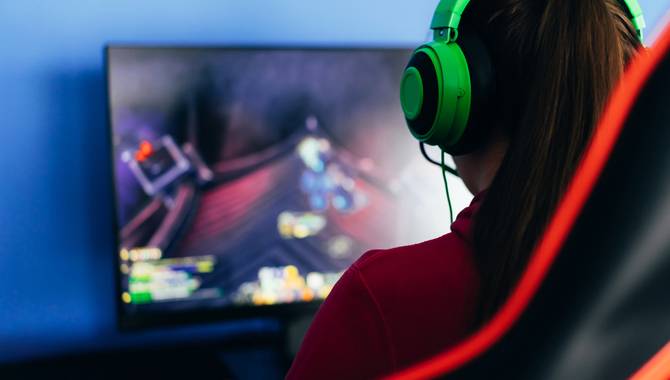
Locate an element on the screen. This screenshot has width=670, height=380. wires to headphones is located at coordinates (447, 192).